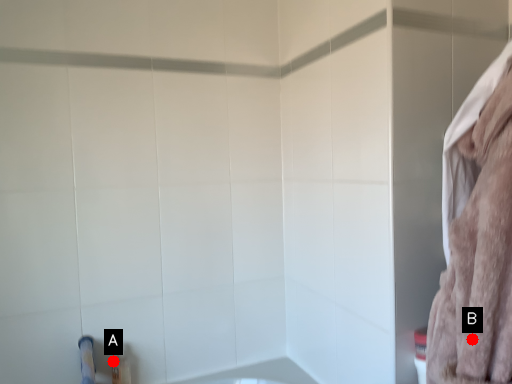
Question: Two points are circled on the image, labeled by A and B beside each circle. Which point is closer to the camera?

Choices:
 (A) A is closer
 (B) B is closer

Answer: (B)